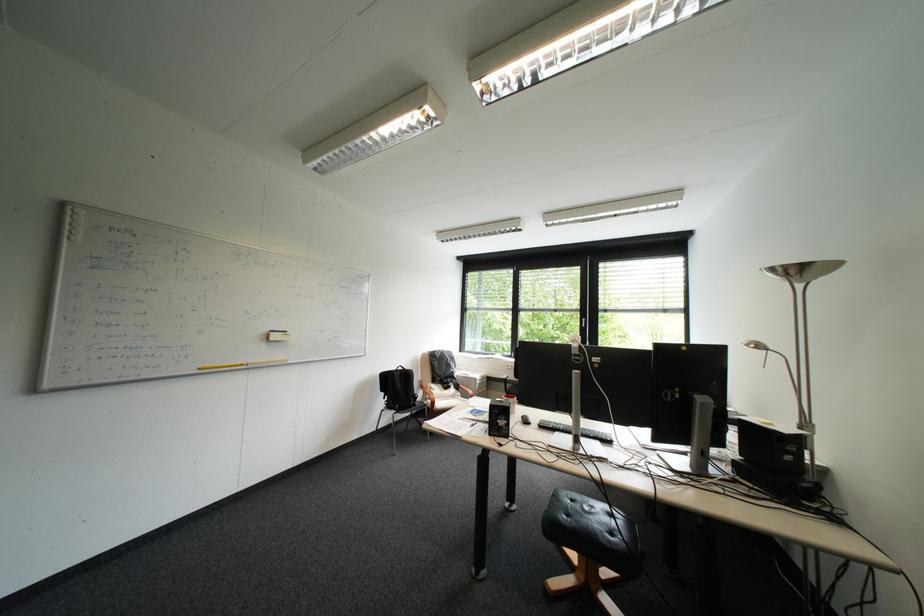
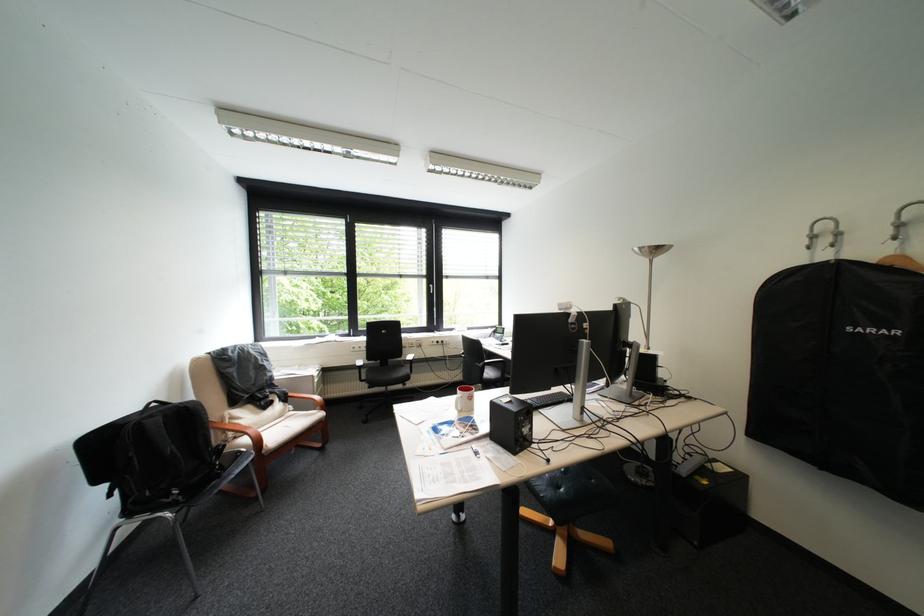
Where in the second image is the point corresponding to point 419,371 from the first image?

(199, 407)